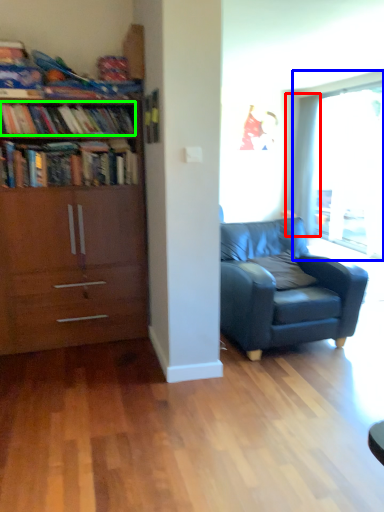
Question: Which is nearer to the curtain (highlighted by a red box)? window (highlighted by a blue box) or book (highlighted by a green box).

Choices:
 (A) window
 (B) book

Answer: (A)